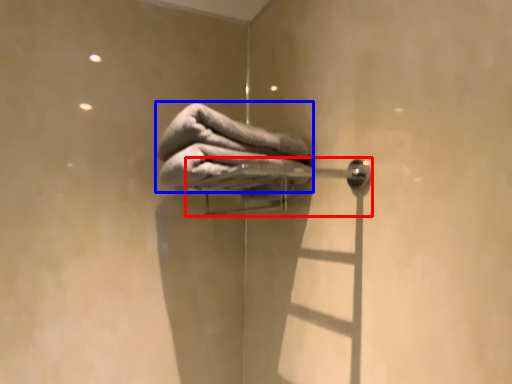
Question: Which object appears closest to the camera in this image, door handle (highlighted by a red box) or towel (highlighted by a blue box)?

Choices:
 (A) door handle
 (B) towel

Answer: (A)